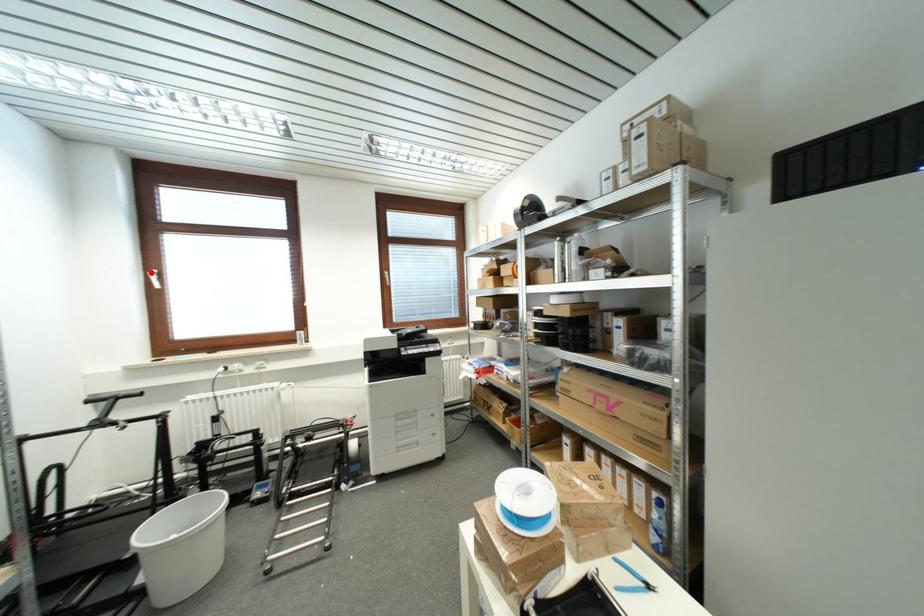
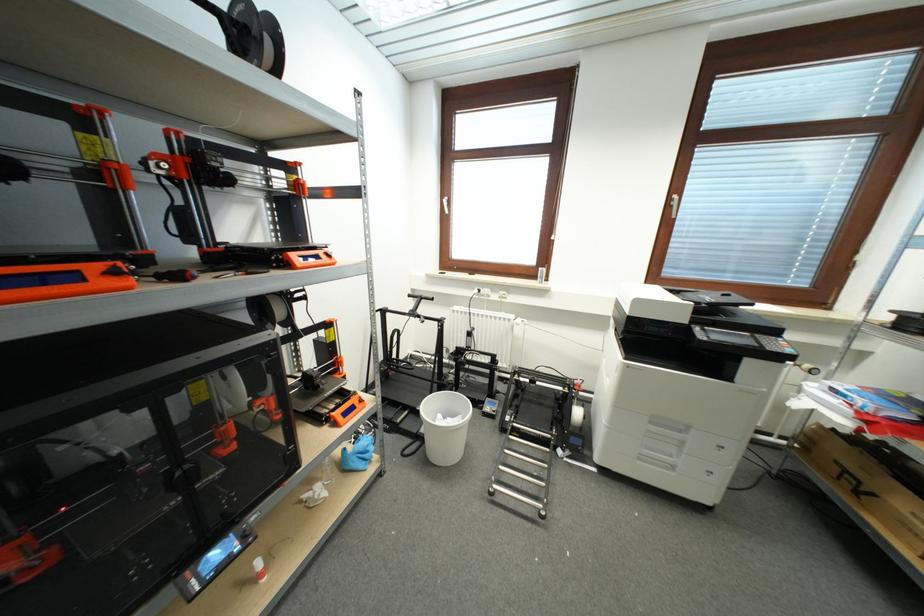
The point at the highlighted location is marked in the first image. Where is the corresponding point in the second image?

(446, 200)